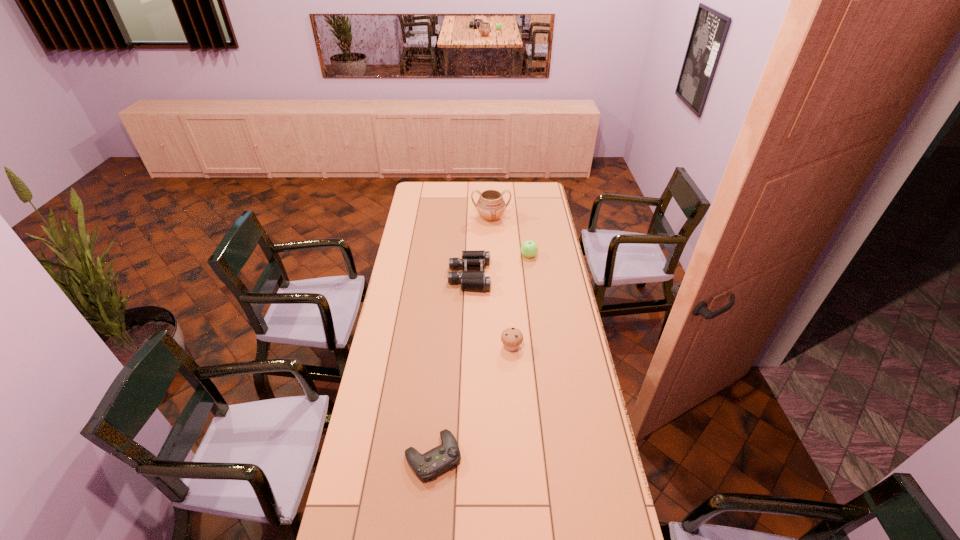
Where is `free space that satisfies the following two spatial constraints: 1. on the front-facing side of the apple; 2. on the right side of the urn`? The width and height of the screenshot is (960, 540). free space that satisfies the following two spatial constraints: 1. on the front-facing side of the apple; 2. on the right side of the urn is located at coordinates click(x=492, y=256).

Locate an element on the screen. The width and height of the screenshot is (960, 540). vacant region that satisfies the following two spatial constraints: 1. on the front-facing side of the farthest object; 2. on the front-facing side of the binoculars is located at coordinates (492, 276).

Locate an element on the screen. The image size is (960, 540). vacant space that satisfies the following two spatial constraints: 1. on the front-facing side of the urn; 2. on the front-facing side of the binoculars is located at coordinates (492, 276).

The image size is (960, 540). In order to click on vacant point that satisfies the following two spatial constraints: 1. on the front-facing side of the rightmost object; 2. on the left side of the farthest object in this screenshot , I will do `click(492, 256)`.

The height and width of the screenshot is (540, 960). I want to click on free space in the image that satisfies the following two spatial constraints: 1. on the front-facing side of the fourth farthest object; 2. on the left side of the binoculars, so click(x=468, y=347).